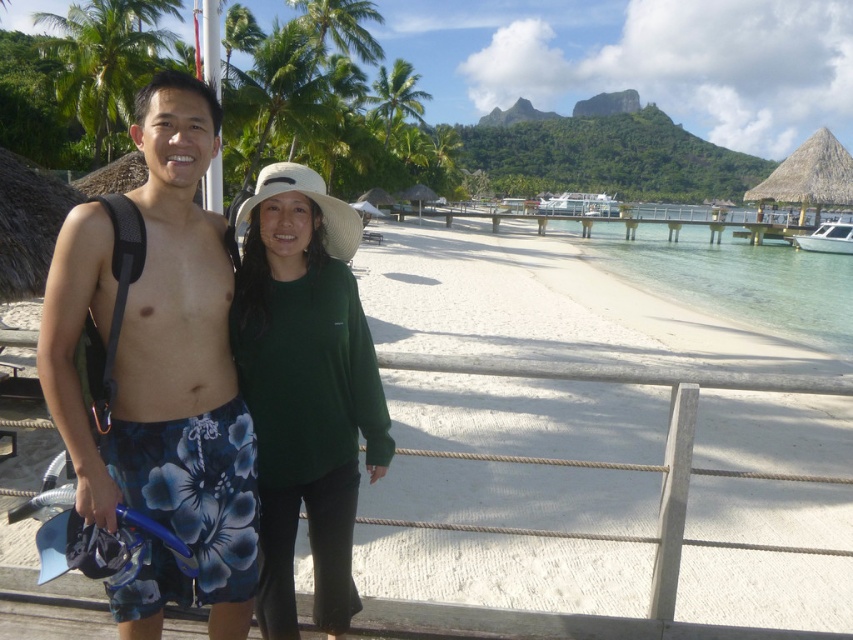
Is white sand beach at center taller than blue floral swim trunks at center?

Indeed, white sand beach at center has a greater height compared to blue floral swim trunks at center.

Between white sand beach at center and blue floral swim trunks at center, which one appears on the right side from the viewer's perspective?

From the viewer's perspective, white sand beach at center appears more on the right side.

Find the location of a particular element. white sand beach at center is located at coordinates (587, 449).

You are a GUI agent. You are given a task and a screenshot of the screen. Output one action in this format:
    pyautogui.click(x=<x>, y=<y>)
    Task: Click on the white sand beach at center
    The image size is (853, 640).
    Given the screenshot: What is the action you would take?
    pyautogui.click(x=587, y=449)

Is blue floral swim trunks at center shorter than clear water at beach right?

Yes.

Is blue floral swim trunks at center further to the viewer compared to clear water at beach right?

No, it is in front of clear water at beach right.

Identify the location of blue floral swim trunks at center. This screenshot has height=640, width=853. (x=160, y=372).

Find the location of a particular element. The image size is (853, 640). blue floral swim trunks at center is located at coordinates (160, 372).

Which is below, blue floral swim trunks at center or green matte hat at center?

green matte hat at center

Between blue floral swim trunks at center and green matte hat at center, which one has less height?

With less height is green matte hat at center.

Is point (239, 628) positioned in front of point (360, 358)?

No, (239, 628) is behind (360, 358).

In order to click on blue floral swim trunks at center in this screenshot , I will do tap(160, 372).